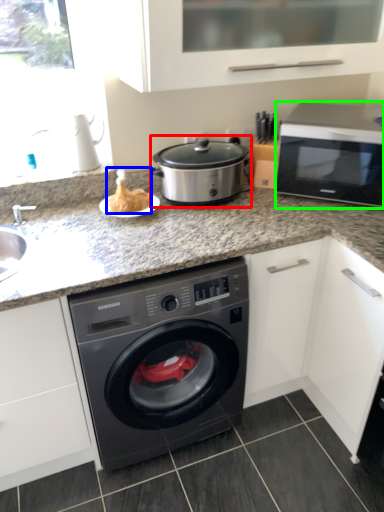
Question: Considering the real-world distances, which object is farthest from slow cooker (highlighted by a red box)? food (highlighted by a blue box) or microwave oven (highlighted by a green box)?

Choices:
 (A) food
 (B) microwave oven

Answer: (B)